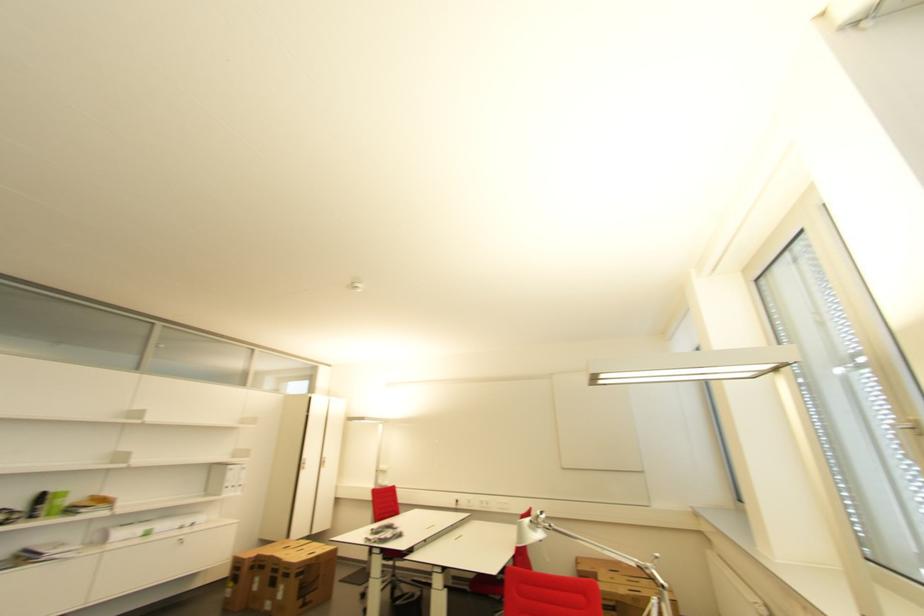
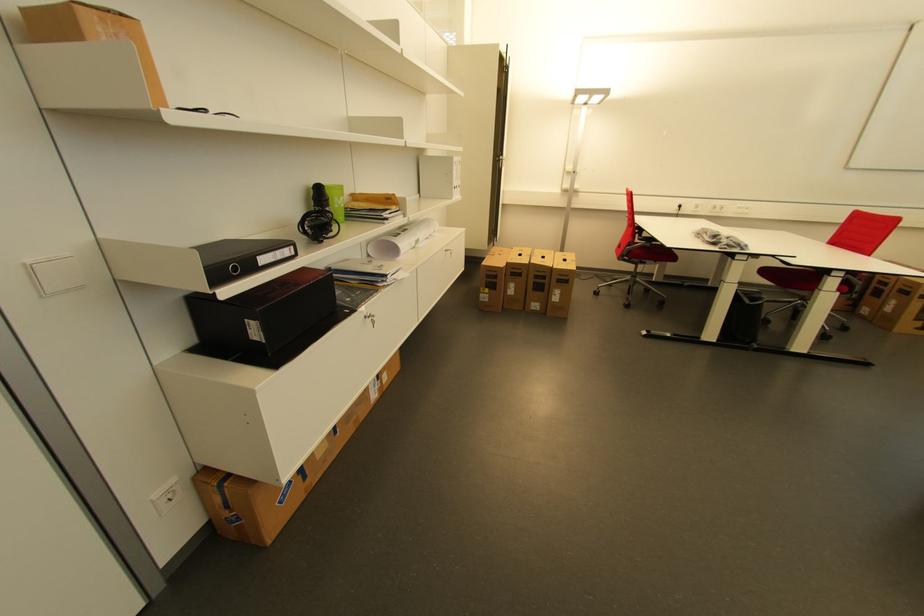
In the second image, find the point that corresponds to pixel 55 498 in the first image.

(333, 193)